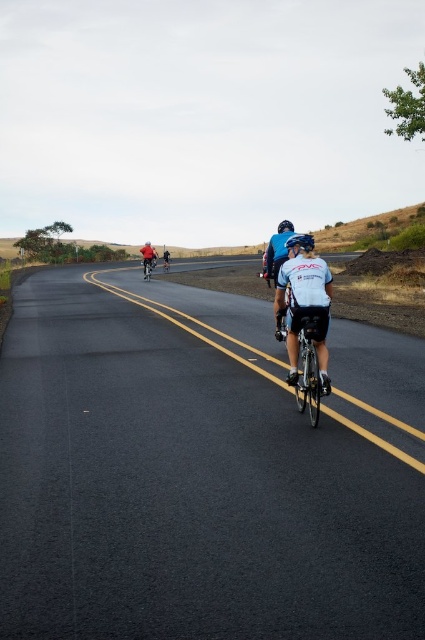
Does matte blue helmet at center appear under shiny red bicycle at center?

Yes, matte blue helmet at center is below shiny red bicycle at center.

Locate an element on the screen. matte blue helmet at center is located at coordinates 300,243.

Where is `matte blue helmet at center`? The height and width of the screenshot is (640, 425). matte blue helmet at center is located at coordinates (300, 243).

Can you confirm if shiny silver bicycle at center is wider than matte red bicycle at center?

Incorrect, shiny silver bicycle at center's width does not surpass matte red bicycle at center's.

Which is in front, point (309, 369) or point (153, 256)?

Positioned in front is point (309, 369).

You are a GUI agent. You are given a task and a screenshot of the screen. Output one action in this format:
    pyautogui.click(x=<x>, y=<y>)
    Task: Click on the shiny silver bicycle at center
    
    Given the screenshot: What is the action you would take?
    pyautogui.click(x=308, y=356)

Which is below, white matte jersey at center or shiny metallic bicycle at center?

white matte jersey at center

Who is more distant from viewer, (300, 288) or (167, 264)?

The point (167, 264) is behind.

Find the location of a particular element. The image size is (425, 640). white matte jersey at center is located at coordinates (303, 300).

The image size is (425, 640). I want to click on white matte jersey at center, so click(x=303, y=300).